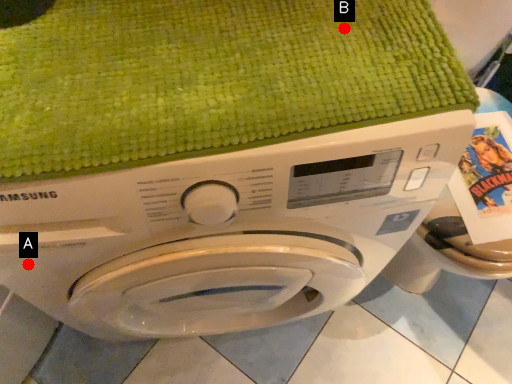
Question: Two points are circled on the image, labeled by A and B beside each circle. Which point is farther to the camera?

Choices:
 (A) A is further
 (B) B is further

Answer: (A)